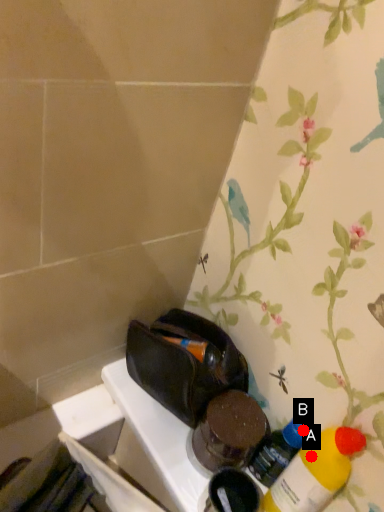
Question: Two points are circled on the image, labeled by A and B beside each circle. Which point is closer to the camera?

Choices:
 (A) A is closer
 (B) B is closer

Answer: (A)